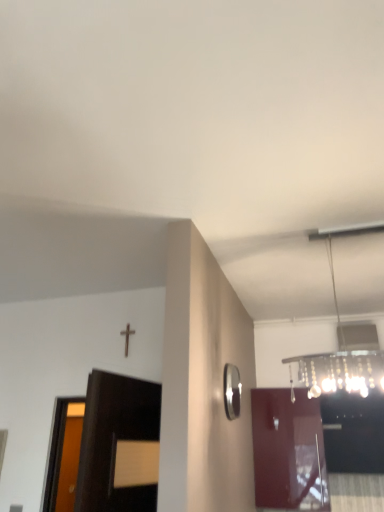
Question: Is point (317, 463) positioned closer to the camera than point (235, 381)?

Choices:
 (A) farther
 (B) closer

Answer: (A)

Question: Is glossy wood door at center situated inside polished silver mirror at right or outside?

Choices:
 (A) inside
 (B) outside

Answer: (B)

Question: Which is farther from the polished silver mirror at right?

Choices:
 (A) glossy wood door at center
 (B) clear glass chandelier at upper right

Answer: (A)

Question: Which object is the farthest from the polished silver mirror at right?

Choices:
 (A) clear glass chandelier at upper right
 (B) glossy wood door at center

Answer: (B)